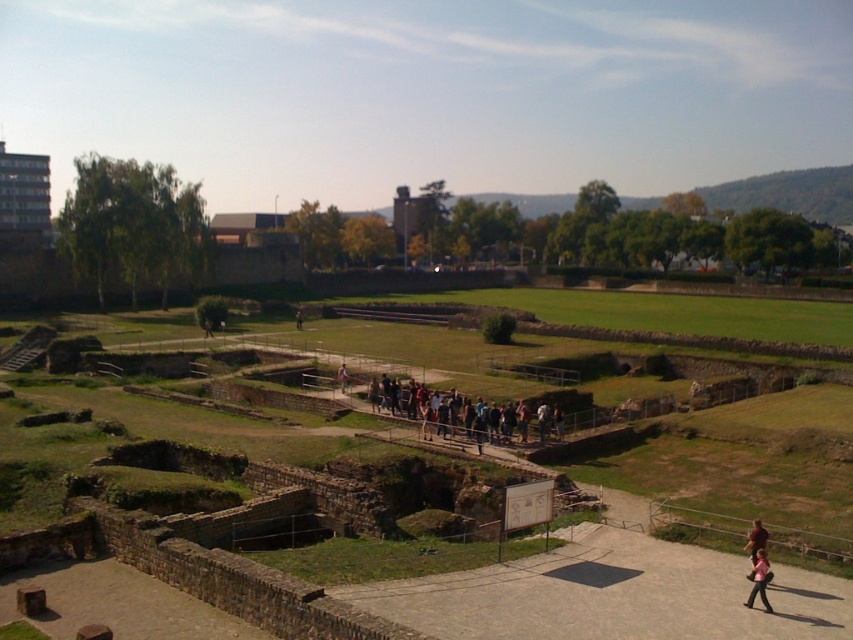
Question: Does dark gray backpack at center appear on the right side of light brown wooden bench at center?

Choices:
 (A) no
 (B) yes

Answer: (B)

Question: Does brown stone ruins at center have a greater width compared to brown leather jacket at lower right?

Choices:
 (A) yes
 (B) no

Answer: (A)

Question: Which object is positioned farthest from the brown stone ruins at center?

Choices:
 (A) light brown wooden bench at center
 (B) smooth stone pathway at center

Answer: (A)

Question: Is brown stone ruins at center below brown leather jacket at lower right?

Choices:
 (A) no
 (B) yes

Answer: (A)

Question: Which object is positioned farthest from the pink fabric person at lower right?

Choices:
 (A) dark gray backpack at center
 (B) light brown wooden bench at center

Answer: (B)

Question: Which of these objects is positioned closest to the smooth stone pathway at center?

Choices:
 (A) dark gray backpack at center
 (B) light brown wooden bench at center
 (C) brown stone ruins at center

Answer: (C)